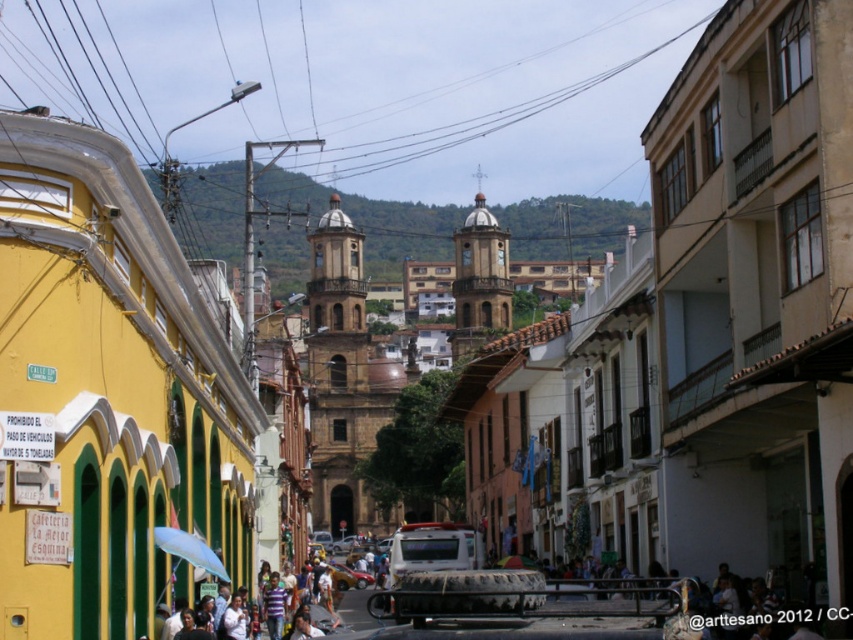
You are standing at the corner of the street and want to find the white matte umbrella at lower center. According to the coordinates given, where should you look relative to the Cafeteria La Mejor Esquina?

The white matte umbrella at lower center is located at coordinates point [189,548], which places it to the right and slightly forward of the Cafeteria La Mejor Esquina.